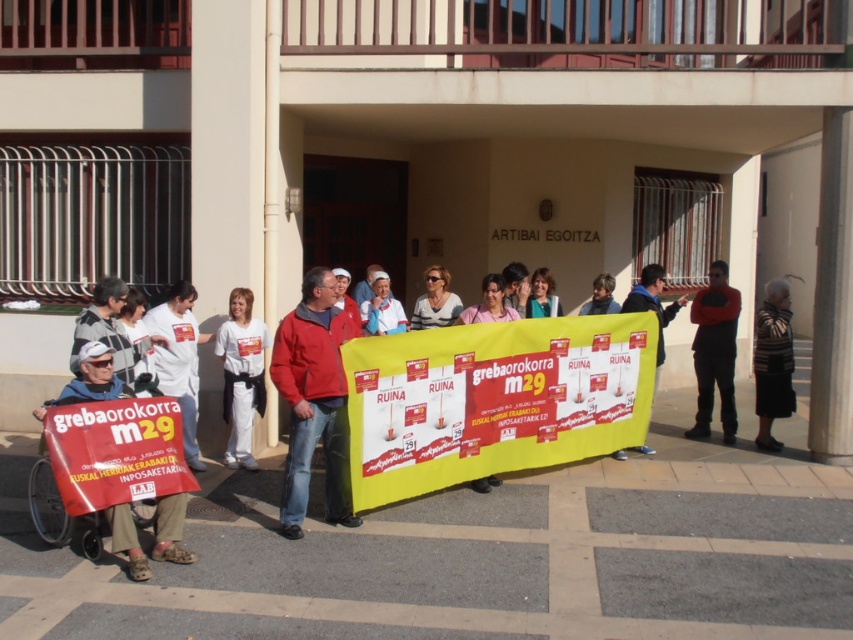
Does point (766, 381) come farther from viewer compared to point (381, 308)?

Yes.

Can you confirm if striped sweater at right is bigger than light blue fabric at center?

Indeed, striped sweater at right has a larger size compared to light blue fabric at center.

Does point (762, 336) lie in front of point (370, 323)?

No, it is behind (370, 323).

Locate an element on the screen. striped sweater at right is located at coordinates (773, 362).

Based on the photo, which is more to the right, black leather jacket at right or white cotton shirt at center?

Positioned to the right is black leather jacket at right.

In the scene shown: Who is positioned more to the left, black leather jacket at right or white cotton shirt at center?

From the viewer's perspective, white cotton shirt at center appears more on the left side.

Measure the distance between point (698, 353) and camera.

They are 33.07 feet apart.

This screenshot has height=640, width=853. What are the coordinates of `black leather jacket at right` in the screenshot? It's located at (714, 352).

In the scene shown: Is red matte jacket at center taller than white textured shirt at center?

Yes, red matte jacket at center is taller than white textured shirt at center.

Is red matte jacket at center bigger than white textured shirt at center?

Indeed, red matte jacket at center has a larger size compared to white textured shirt at center.

Locate an element on the screen. Image resolution: width=853 pixels, height=640 pixels. red matte jacket at center is located at coordinates (312, 397).